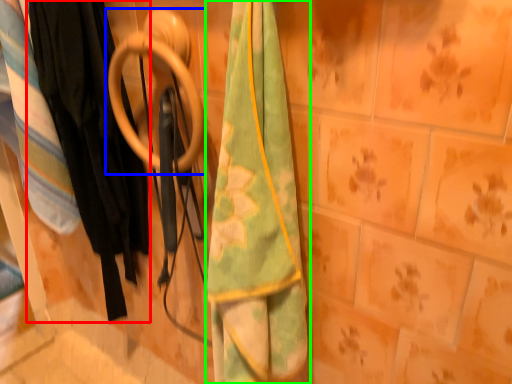
Question: Which object is positioned farthest from clothing (highlighted by a red box)? Select from door handle (highlighted by a blue box) and towel (highlighted by a green box).

Choices:
 (A) door handle
 (B) towel

Answer: (B)